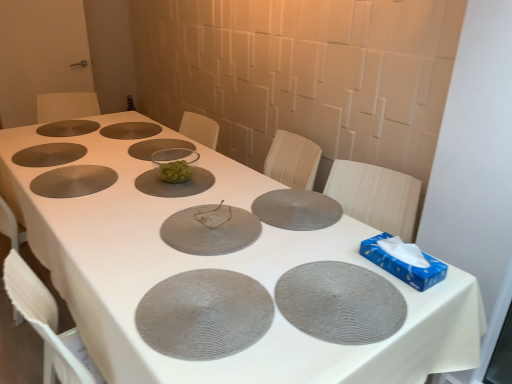
Where is `vacant space situated on the left part of matte gray placemat at center, acting as the 7th glass plate starting from the back`? Image resolution: width=512 pixels, height=384 pixels. vacant space situated on the left part of matte gray placemat at center, acting as the 7th glass plate starting from the back is located at coordinates (214, 187).